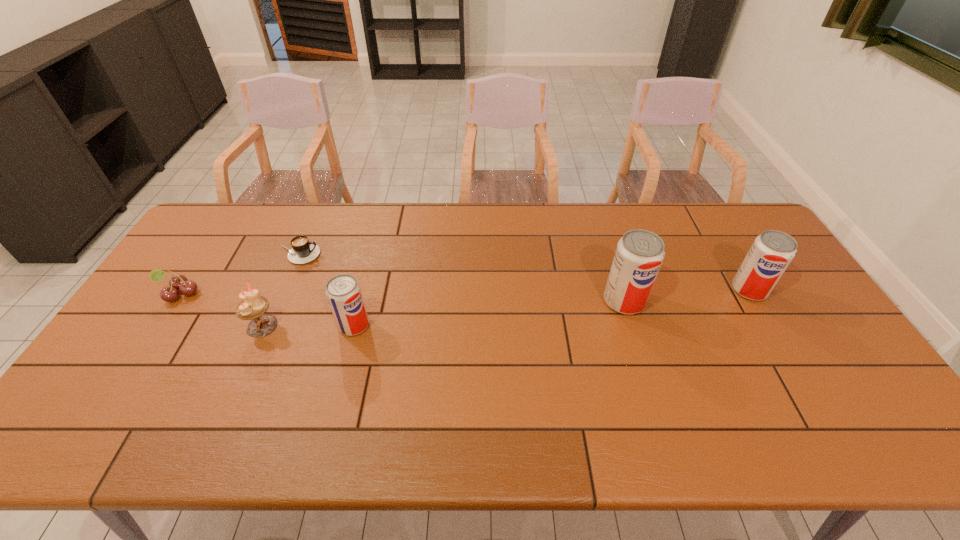
The height and width of the screenshot is (540, 960). Find the location of `the leftmost soda`. the leftmost soda is located at coordinates (343, 291).

The height and width of the screenshot is (540, 960). I want to click on the third object from right to left, so click(x=343, y=291).

I want to click on the second soda from left to right, so 639,254.

This screenshot has height=540, width=960. In order to click on the second tallest object in this screenshot , I will do `click(771, 253)`.

Find the location of `the second shortest soda`. the second shortest soda is located at coordinates (771, 253).

Image resolution: width=960 pixels, height=540 pixels. I want to click on the shortest object, so click(303, 251).

The height and width of the screenshot is (540, 960). Identify the location of cappuccino. (303, 251).

Where is `cherry`? This screenshot has height=540, width=960. cherry is located at coordinates (177, 282).

I want to click on the fifth tallest object, so click(177, 282).

The width and height of the screenshot is (960, 540). I want to click on candle holder, so 252,306.